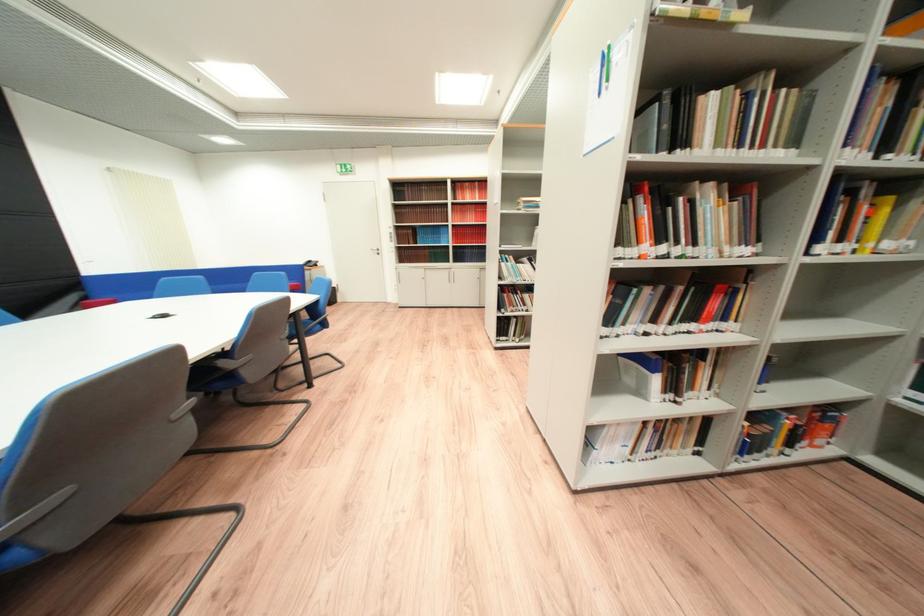
You are a GUI agent. You are given a task and a screenshot of the screen. Output one action in this format:
    pyautogui.click(x=<x>, y=<y>)
    Task: Click on the white door handle
    This screenshot has width=924, height=616.
    Given the screenshot: What is the action you would take?
    pyautogui.click(x=374, y=249)